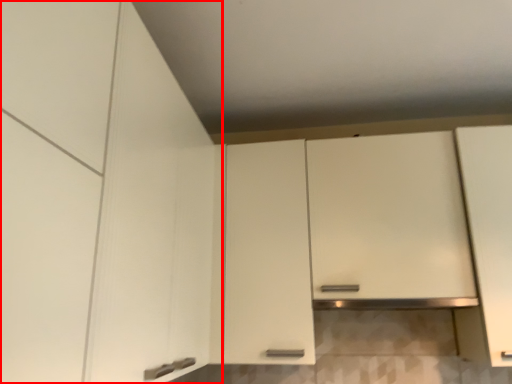
Question: From the image's perspective, what is the correct spatial relationship of cabinetry (annotated by the red box) in relation to cabinetry?

Choices:
 (A) below
 (B) above

Answer: (B)